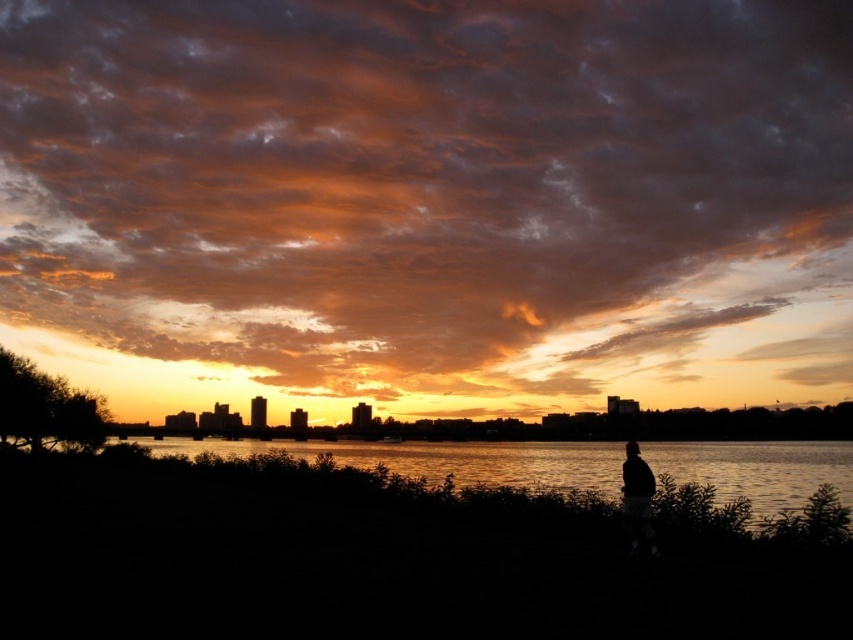
How much distance is there between orange matte cloud at upper center and black matte person at right?

orange matte cloud at upper center is 632.57 feet away from black matte person at right.

Between orange matte cloud at upper center and black matte person at right, which one is positioned higher?

orange matte cloud at upper center

In order to click on orange matte cloud at upper center in this screenshot , I will do `click(430, 198)`.